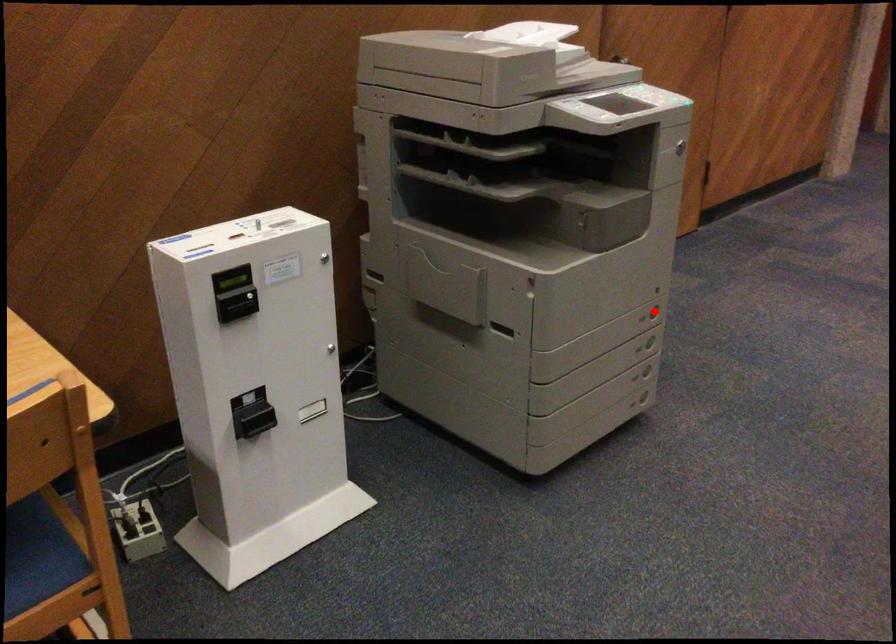
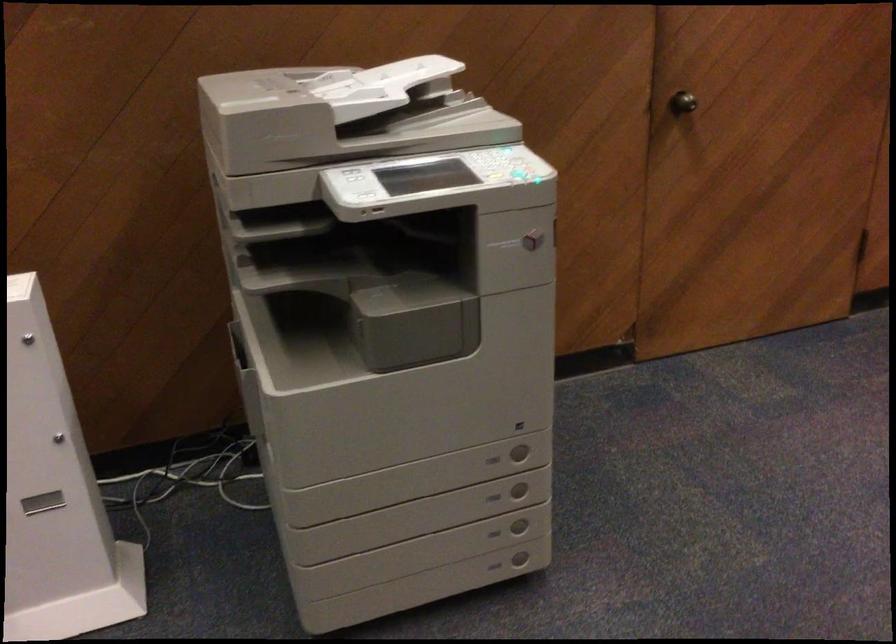
Where in the second image is the point corresponding to the highlighted location from the first image?

(519, 451)